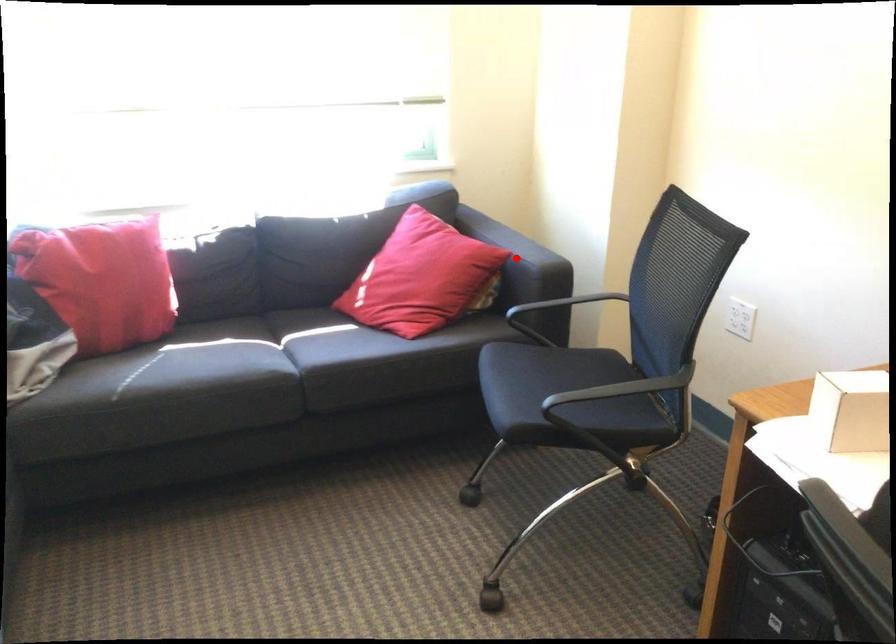
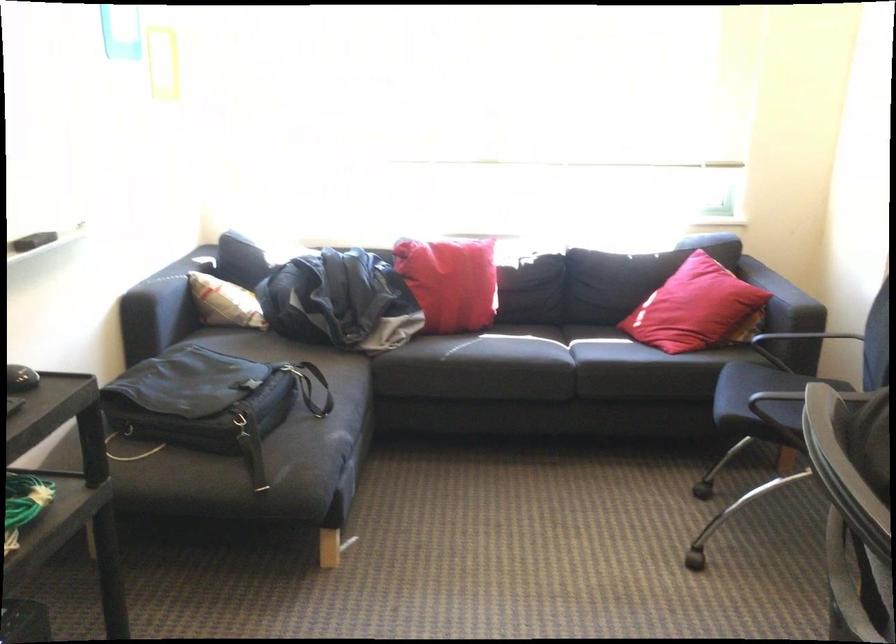
Question: I am providing you with two images of the same scene from different viewpoints. Given a red point in image1, look at the same physical point in image2. Is it:

Choices:
 (A) Closer to the viewpoint
 (B) Farther from the viewpoint

Answer: (B)